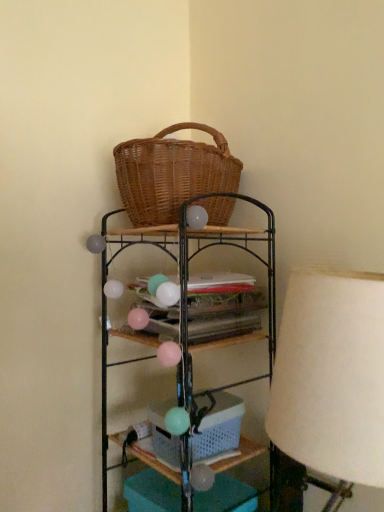
Question: Is matte wicker basket at center in front of or behind white fabric lampshade at right in the image?

Choices:
 (A) front
 (B) behind

Answer: (B)

Question: Looking at the image, does matte wicker basket at center seem bigger or smaller compared to white fabric lampshade at right?

Choices:
 (A) big
 (B) small

Answer: (B)

Question: Which is farther from the woven wood basket at upper center?

Choices:
 (A) matte wicker basket at center
 (B) woven brown picnic basket at upper center
 (C) white fabric lampshade at right

Answer: (C)

Question: Which of these objects is positioned closest to the white fabric lampshade at right?

Choices:
 (A) matte wicker basket at center
 (B) woven brown picnic basket at upper center
 (C) woven wood basket at upper center

Answer: (C)